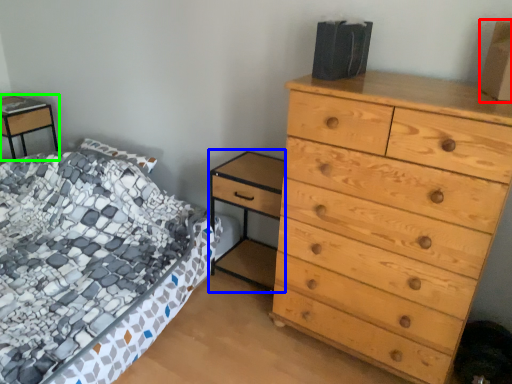
Question: Based on their relative distances, which object is farther from cardboard box (highlighted by a red box)? Choose from nightstand (highlighted by a blue box) and nightstand (highlighted by a green box).

Choices:
 (A) nightstand
 (B) nightstand

Answer: (B)